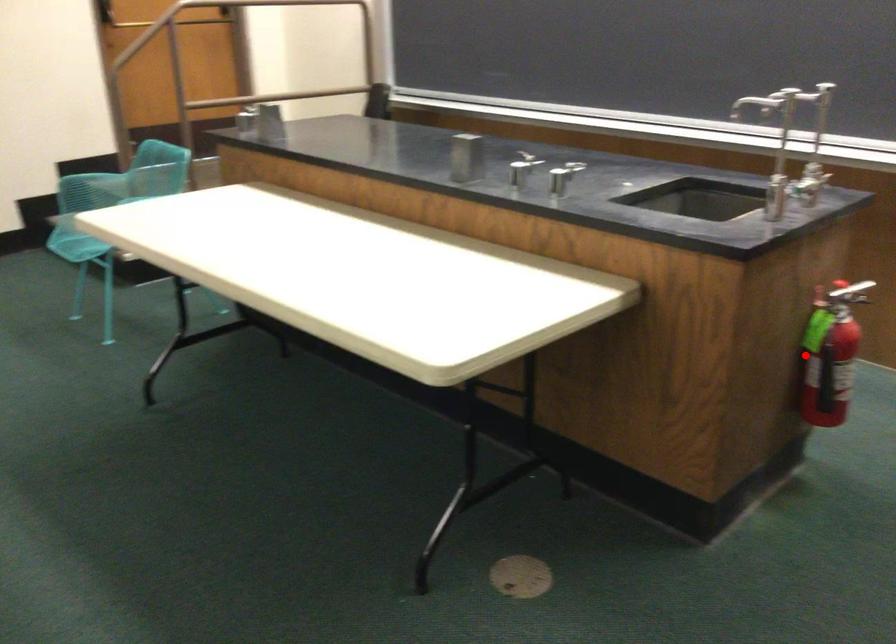
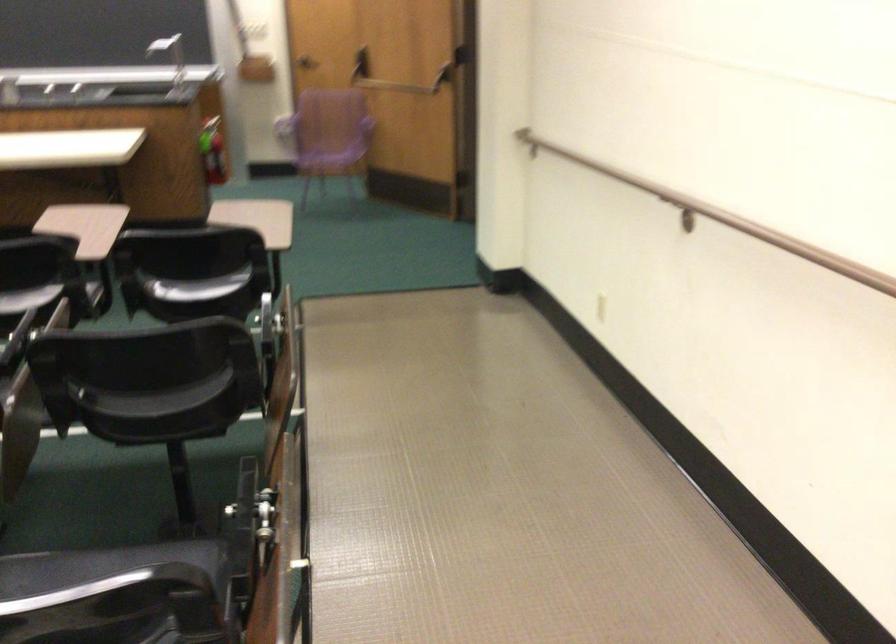
Question: I am providing you with two images of the same scene from different viewpoints. In image1, a red point is highlighted. Considering the same 3D point in image2, which of the following is correct?

Choices:
 (A) It is closer
 (B) It is farther

Answer: (B)